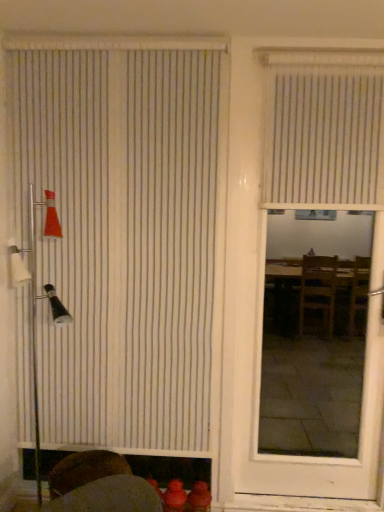
Question: Do you think white vertical blinds at left, which ranks as the first window blind in left-to-right order, is within white vertical blinds at upper right, the 2th window blind positioned from the left, or outside of it?

Choices:
 (A) outside
 (B) inside

Answer: (A)

Question: From a real-world perspective, relative to white vertical blinds at upper right, the 2th window blind positioned from the left, is white vertical blinds at left, which ranks as the first window blind in left-to-right order, vertically above or below?

Choices:
 (A) above
 (B) below

Answer: (B)

Question: Which object is positioned closest to the white vertical blinds at upper right, the 2th window blind positioned from the left?

Choices:
 (A) white matte door at center
 (B) white vertical blinds at left, the 2th window blind positioned from the right

Answer: (A)

Question: Considering the real-world distances, which object is farthest from the white vertical blinds at left, the 2th window blind positioned from the right?

Choices:
 (A) white vertical blinds at upper right, arranged as the first window blind when viewed from the right
 (B) white matte door at center

Answer: (A)